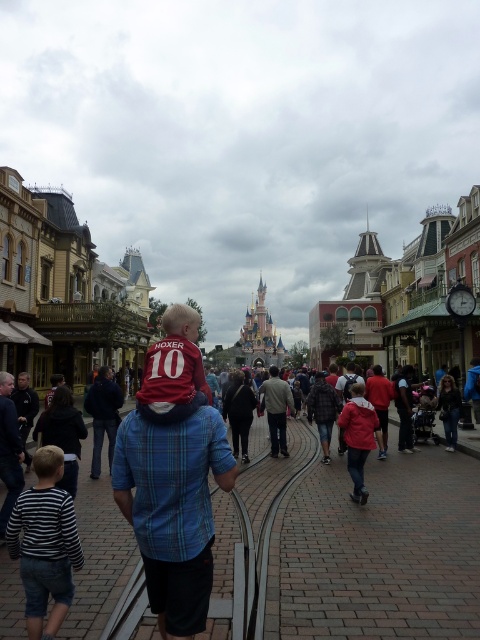
Can you confirm if matte red shirt at center is positioned to the left of striped cotton shirt at lower left?

No, matte red shirt at center is not to the left of striped cotton shirt at lower left.

Based on the photo, does matte red shirt at center have a lesser height compared to striped cotton shirt at lower left?

Correct, matte red shirt at center is not as tall as striped cotton shirt at lower left.

Which is in front, point (459, 544) or point (48, 563)?

Point (48, 563) is more forward.

This screenshot has width=480, height=640. In order to click on matte red shirt at center in this screenshot , I will do `click(346, 547)`.